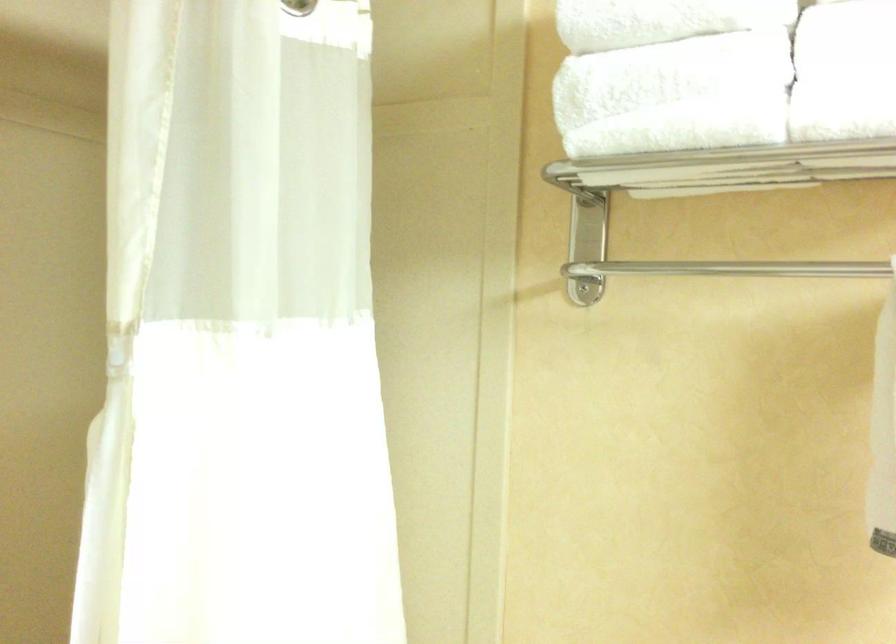
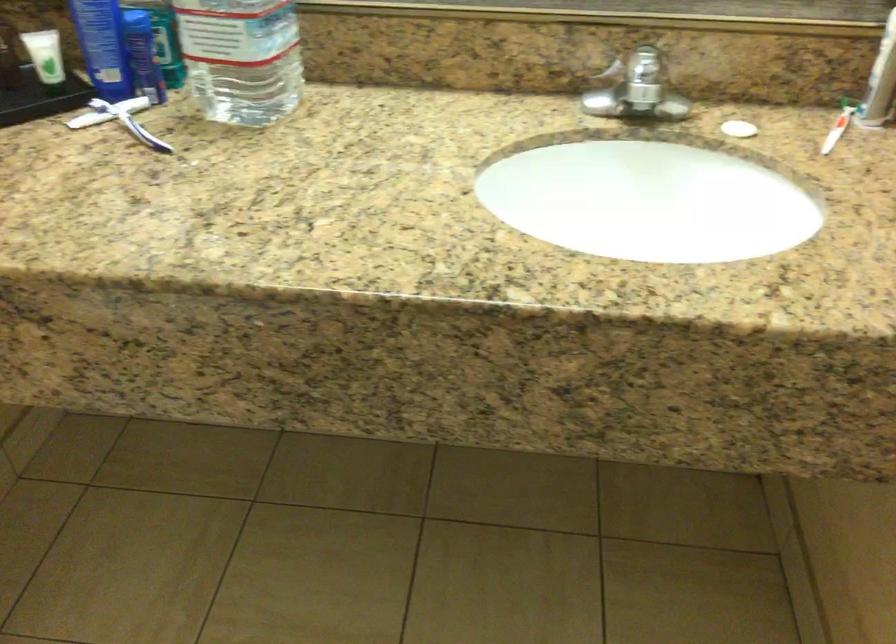
How did the camera likely rotate?

The camera's rotation is toward right-down.